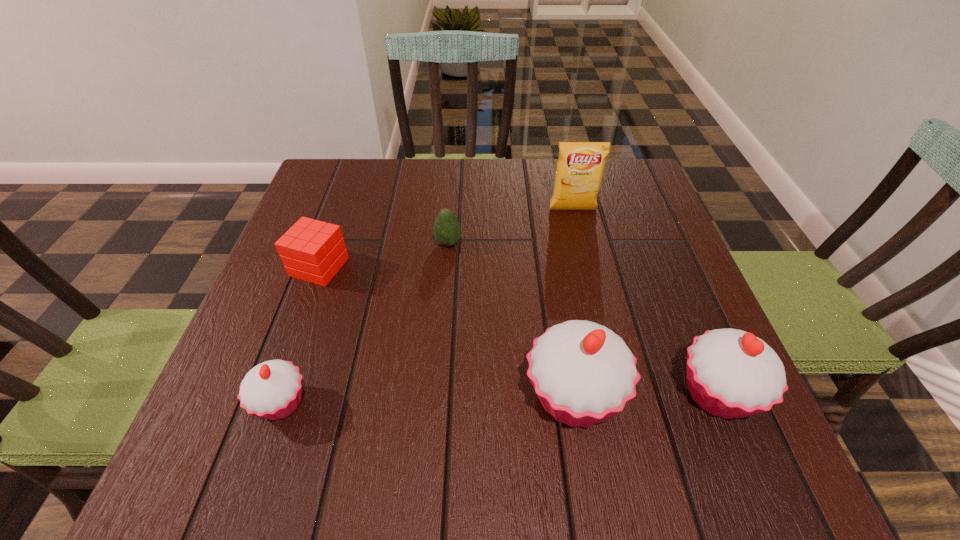
This screenshot has height=540, width=960. I want to click on free spot located 0.110m on the front of the farthest object with the logo, so [581, 245].

Where is `vacant space positioned 0.380m on the right of the third object from left to right`? This screenshot has width=960, height=540. vacant space positioned 0.380m on the right of the third object from left to right is located at coordinates (628, 244).

Locate an element on the screen. vacant area located on the back of the cube is located at coordinates (344, 199).

Where is `object present at the far edge`? object present at the far edge is located at coordinates pyautogui.click(x=580, y=167).

At what (x,y) coordinates should I click in order to perform the action: click on cupcake at the left edge. Please return your answer as a coordinate pair (x, y). Looking at the image, I should click on pos(272,390).

The width and height of the screenshot is (960, 540). I want to click on cube positioned at the left edge, so click(311, 250).

Where is `cupcake situated at the right edge`? The image size is (960, 540). cupcake situated at the right edge is located at coordinates (731, 373).

Identify the location of crisp (potato chip) that is at the right edge. (580, 167).

Image resolution: width=960 pixels, height=540 pixels. Find the location of `object situated at the near left corner`. object situated at the near left corner is located at coordinates (272, 390).

Identify the location of object that is at the far right corner. (580, 167).